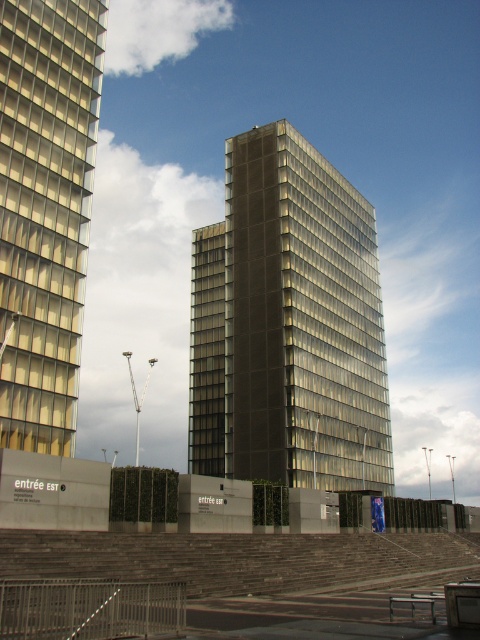
Which is behind, point (192, 268) or point (25, 310)?

The point (192, 268) is behind.

Is matte glass tower at center thinner than matte glass building at left?

Incorrect, matte glass tower at center's width is not less than matte glass building at left's.

Between point (284, 253) and point (73, 381), which one is positioned behind?

Point (284, 253)

I want to click on matte glass tower at center, so click(288, 324).